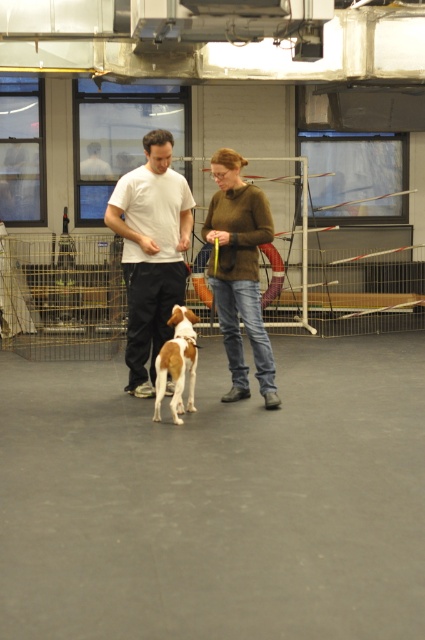
Question: Which point appears closest to the camera in this image?

Choices:
 (A) (229, 205)
 (B) (150, 321)
 (C) (178, 369)

Answer: (C)

Question: Does matte brown sweater at center lie in front of brown and white fur dog at center?

Choices:
 (A) no
 (B) yes

Answer: (A)

Question: Considering the real-world distances, which object is closest to the matte brown sweater at center?

Choices:
 (A) white matte t-shirt at center
 (B) brown and white fur dog at center

Answer: (A)

Question: Which point is closer to the camera?

Choices:
 (A) matte brown sweater at center
 (B) brown and white fur dog at center
 (C) white matte t-shirt at center

Answer: (B)

Question: Does white matte t-shirt at center have a larger size compared to brown and white fur dog at center?

Choices:
 (A) yes
 (B) no

Answer: (A)

Question: From the image, what is the correct spatial relationship of matte brown sweater at center in relation to brown and white fur dog at center?

Choices:
 (A) right
 (B) left

Answer: (A)